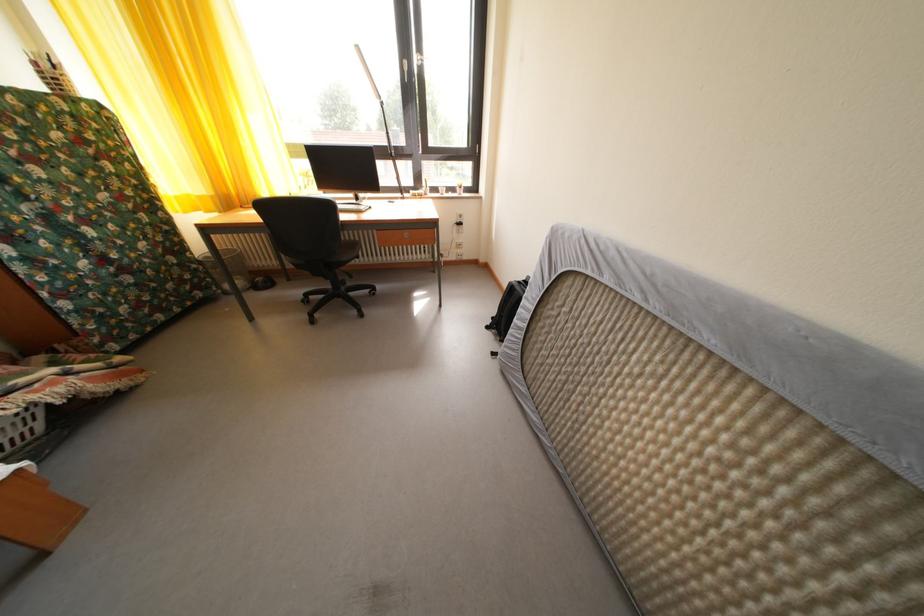
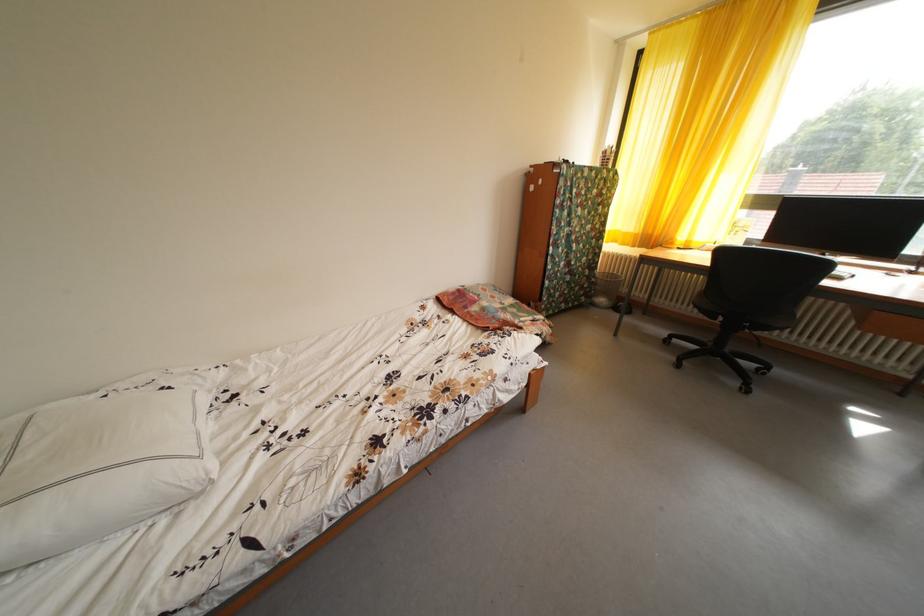
Question: Based on the continuous images, in which direction is the camera rotating? Reply with the corresponding letter.

Choices:
 (A) Left
 (B) Right
 (C) Up
 (D) Down

Answer: (A)